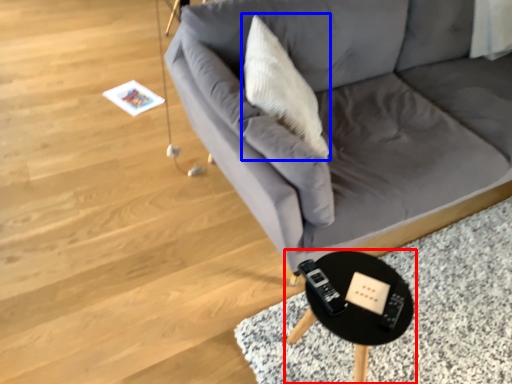
Question: Which object appears farthest to the camera in this image, table (highlighted by a red box) or throw pillow (highlighted by a blue box)?

Choices:
 (A) table
 (B) throw pillow

Answer: (B)